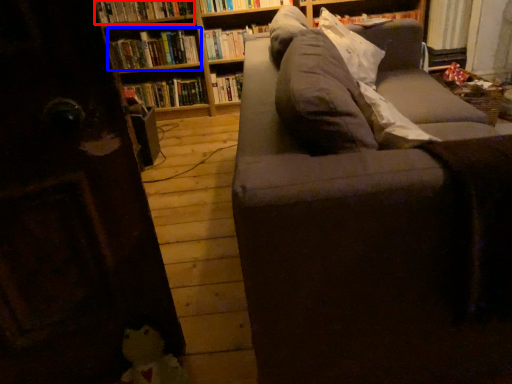
Question: Which object is closer to the camera taking this photo, book (highlighted by a red box) or book (highlighted by a blue box)?

Choices:
 (A) book
 (B) book

Answer: (A)